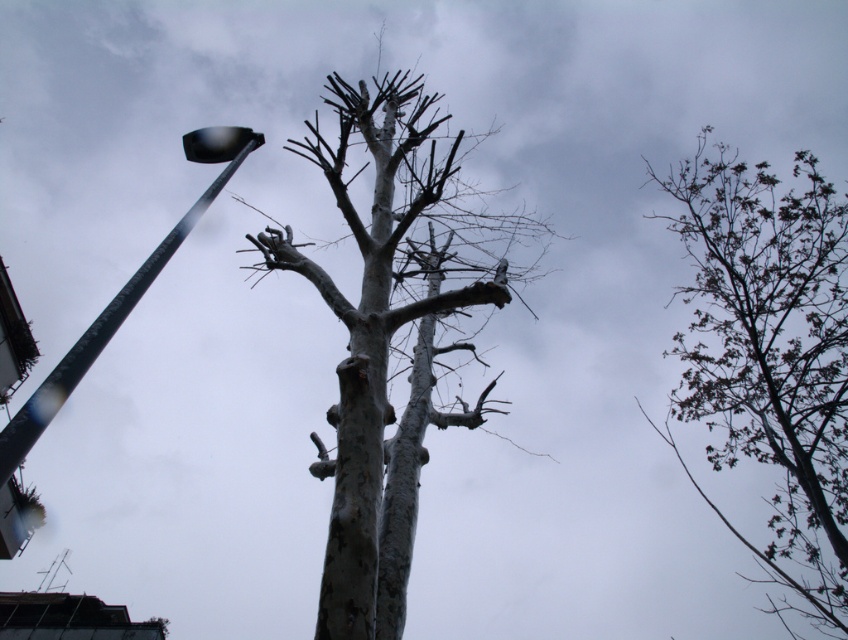
Describe the element at coordinates (770, 356) in the screenshot. I see `dark green leafy tree at upper right` at that location.

Does dark green leafy tree at upper right have a larger size compared to metallic gray street light at left?

Yes, dark green leafy tree at upper right is bigger than metallic gray street light at left.

You are a GUI agent. You are given a task and a screenshot of the screen. Output one action in this format:
    pyautogui.click(x=<x>, y=<y>)
    Task: Click on the dark green leafy tree at upper right
    
    Given the screenshot: What is the action you would take?
    [x=770, y=356]

Measure the distance between point [459,364] and camera.

Point [459,364] and camera are 30.19 feet apart.

Is smooth bark tree at center to the right of metallic gray street light at left from the viewer's perspective?

Indeed, smooth bark tree at center is positioned on the right side of metallic gray street light at left.

Is point (395, 435) positioned in front of point (220, 138)?

No.

You are a GUI agent. You are given a task and a screenshot of the screen. Output one action in this format:
    pyautogui.click(x=<x>, y=<y>)
    Task: Click on the smooth bark tree at center
    This screenshot has width=848, height=640.
    Given the screenshot: What is the action you would take?
    pyautogui.click(x=397, y=324)

Where is `smooth bark tree at center`? This screenshot has width=848, height=640. smooth bark tree at center is located at coordinates (397, 324).

Which of these two, smooth bark tree at center or dark green leafy tree at upper right, stands shorter?

Standing shorter between the two is dark green leafy tree at upper right.

Who is more forward, (427, 333) or (752, 416)?

Point (427, 333) is more forward.

Image resolution: width=848 pixels, height=640 pixels. I want to click on smooth bark tree at center, so point(397,324).